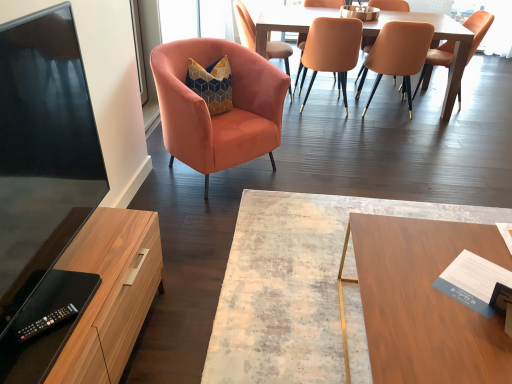
Image resolution: width=512 pixels, height=384 pixels. Identify the location of free location in front of black plastic remote control at lower left. (36, 356).